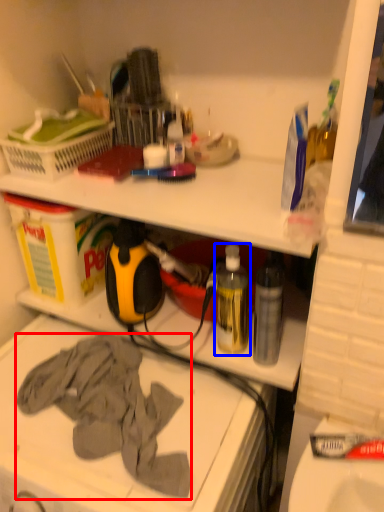
Question: Which point is further to the camera, clothing (highlighted by a red box) or bottle (highlighted by a blue box)?

Choices:
 (A) clothing
 (B) bottle

Answer: (B)